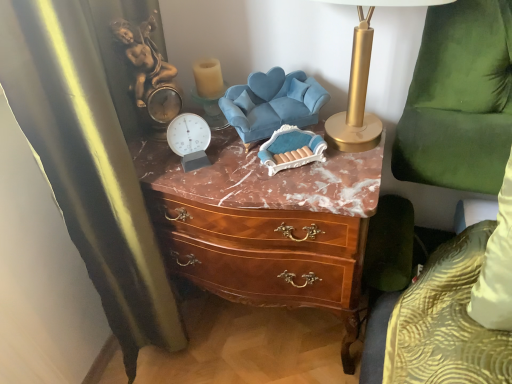
Question: Can you confirm if translucent glass candle at upper center is wider than black velvet curtain at left?

Choices:
 (A) yes
 (B) no

Answer: (B)

Question: Is translucent glass candle at upper center positioned with its back to black velvet curtain at left?

Choices:
 (A) no
 (B) yes

Answer: (A)

Question: Is translucent glass candle at upper center bigger than black velvet curtain at left?

Choices:
 (A) no
 (B) yes

Answer: (A)

Question: From the image's perspective, is translucent glass candle at upper center above black velvet curtain at left?

Choices:
 (A) no
 (B) yes

Answer: (B)

Question: Is translucent glass candle at upper center smaller than black velvet curtain at left?

Choices:
 (A) yes
 (B) no

Answer: (A)

Question: Is translucent glass candle at upper center positioned before black velvet curtain at left?

Choices:
 (A) no
 (B) yes

Answer: (A)

Question: Is velvet blue swivel chair at center, acting as the 2th swivel chair starting from the right, thinner than green velvet swivel chair at right, which is the 1th swivel chair from right to left?

Choices:
 (A) no
 (B) yes

Answer: (B)

Question: From the image's perspective, is velvet blue swivel chair at center, which is the 1th swivel chair from left to right, above green velvet swivel chair at right, which is the 1th swivel chair from right to left?

Choices:
 (A) no
 (B) yes

Answer: (B)

Question: Can you confirm if velvet blue swivel chair at center, which is the 1th swivel chair from left to right, is bigger than green velvet swivel chair at right, which is the 2th swivel chair from left to right?

Choices:
 (A) no
 (B) yes

Answer: (A)

Question: Is velvet blue swivel chair at center, acting as the 2th swivel chair starting from the right, turned away from green velvet swivel chair at right, which is the 2th swivel chair from left to right?

Choices:
 (A) yes
 (B) no

Answer: (B)

Question: Is velvet blue swivel chair at center, acting as the 2th swivel chair starting from the right, touching green velvet swivel chair at right, which is the 2th swivel chair from left to right?

Choices:
 (A) yes
 (B) no

Answer: (B)

Question: Could green velvet swivel chair at right, which is the 1th swivel chair from right to left, be considered to be inside velvet blue swivel chair at center, which is the 1th swivel chair from left to right?

Choices:
 (A) yes
 (B) no

Answer: (B)

Question: Does gold metallic table lamp at upper right appear on the right side of green velvet swivel chair at right, which is the 2th swivel chair from left to right?

Choices:
 (A) yes
 (B) no

Answer: (B)